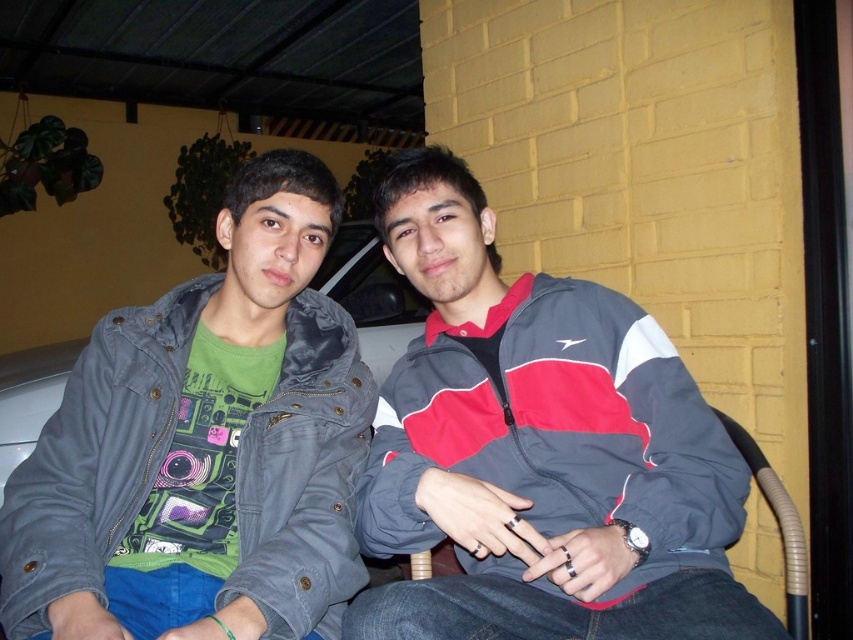
Who is taller, gray/red/white jacket at center or denim jacket at left?

denim jacket at left

In the scene shown: Does gray/red/white jacket at center appear under denim jacket at left?

Yes, gray/red/white jacket at center is below denim jacket at left.

Which is in front, point (596, 496) or point (117, 465)?

Point (117, 465)

The image size is (853, 640). Identify the location of gray/red/white jacket at center. (540, 451).